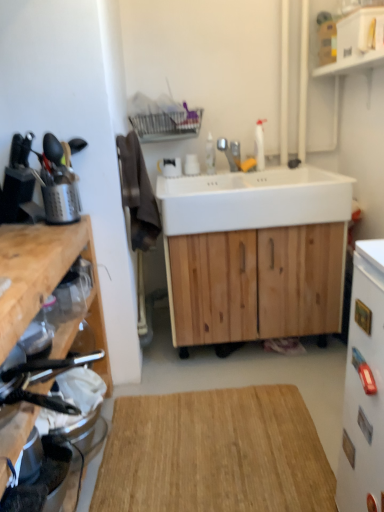
Question: From the image's perspective, is metallic silver utensil holder at left, the 4th appliance in the right-to-left sequence, located above or below white glossy refrigerator at right, which is the 5th appliance from left to right?

Choices:
 (A) above
 (B) below

Answer: (A)

Question: From a real-world perspective, is metallic silver utensil holder at left, the 4th appliance in the right-to-left sequence, positioned above or below white glossy refrigerator at right, the first appliance positioned from the right?

Choices:
 (A) below
 (B) above

Answer: (B)

Question: Estimate the real-world distances between objects in this image. Which object is closer to the natural wood cabinet at center, positioned as the 2th cabinetry in left-to-right order?

Choices:
 (A) metallic silver toaster at left, which ranks as the fourth appliance in left-to-right order
 (B) wooden cutting board at left, arranged as the 1th cabinetry when viewed from the front
 (C) metallic silver utensil holder at left, the 4th appliance in the right-to-left sequence
 (D) white glossy refrigerator at right, which is the 5th appliance from left to right
 (E) clear plastic jar at left, which is the third appliance in right-to-left order

Answer: (B)

Question: Which of these objects is positioned farthest from the brushed metal utensil holder at left, the 1th appliance viewed from the left?

Choices:
 (A) metallic silver toaster at left, which ranks as the fourth appliance in left-to-right order
 (B) wooden cutting board at left, placed as the first cabinetry when sorted from left to right
 (C) natural wood cutting board at center
 (D) metallic silver utensil holder at left, the second appliance positioned from the left
 (E) white ceramic sink at center

Answer: (C)